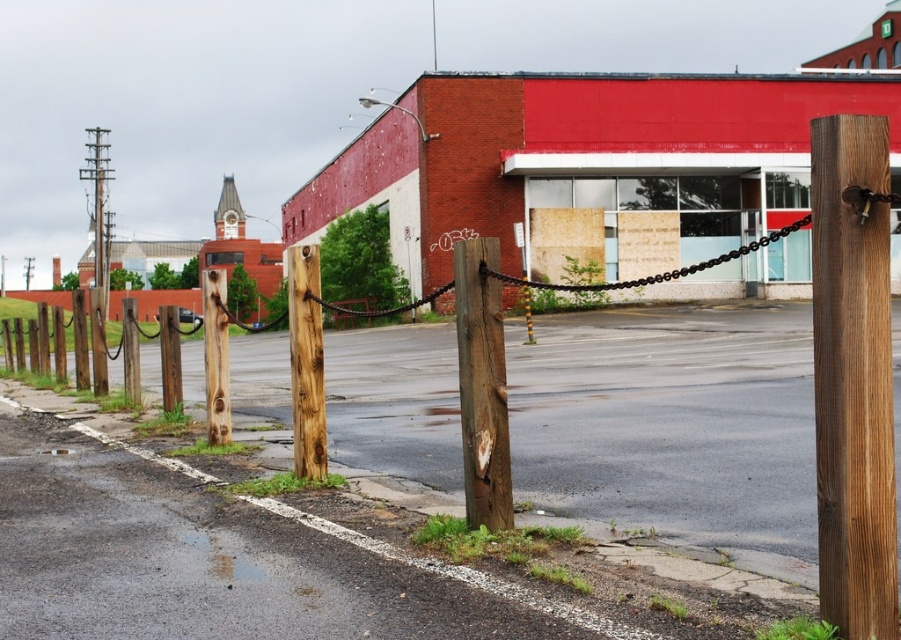
Question: Is natural wood post at center further to camera compared to brown rough wood post at left?

Choices:
 (A) no
 (B) yes

Answer: (A)

Question: Is weathered wood post at center below brown rough wood post at left?

Choices:
 (A) no
 (B) yes

Answer: (B)

Question: Which object appears farthest from the camera in this image?

Choices:
 (A) brown rough wood post at left
 (B) weathered wood post at center
 (C) dark brown wood post at center

Answer: (A)

Question: Is the position of weathered wood post at center less distant than that of brown rough wood post at left?

Choices:
 (A) yes
 (B) no

Answer: (A)

Question: Which of the following is the farthest from the observer?

Choices:
 (A) (224, 301)
 (B) (112, 177)
 (C) (484, 292)
 (D) (827, 257)

Answer: (B)

Question: Which is farther from the brown rough wood post at left?

Choices:
 (A) smooth brown wooden telegraph pole at left
 (B) weathered wood post at center
 (C) natural wood post at center

Answer: (A)